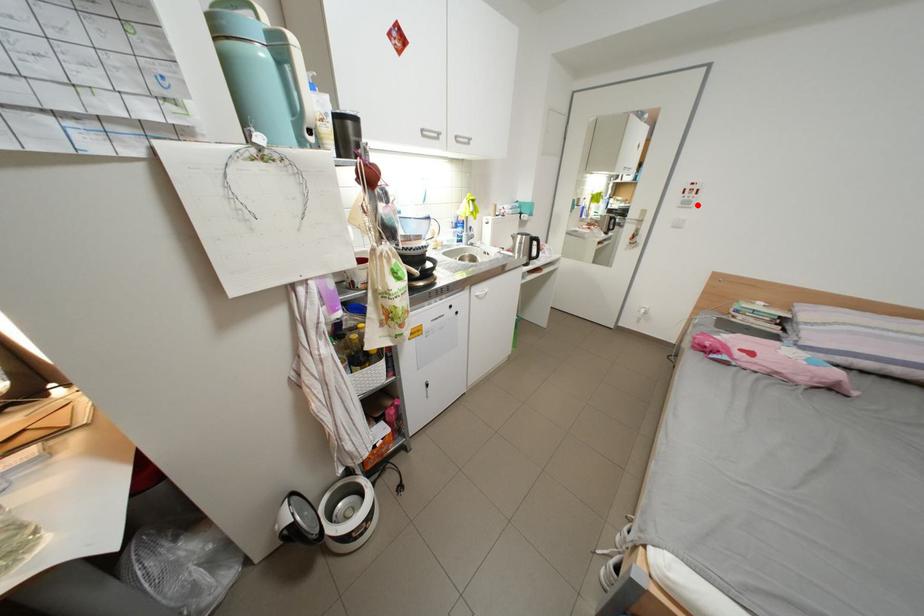
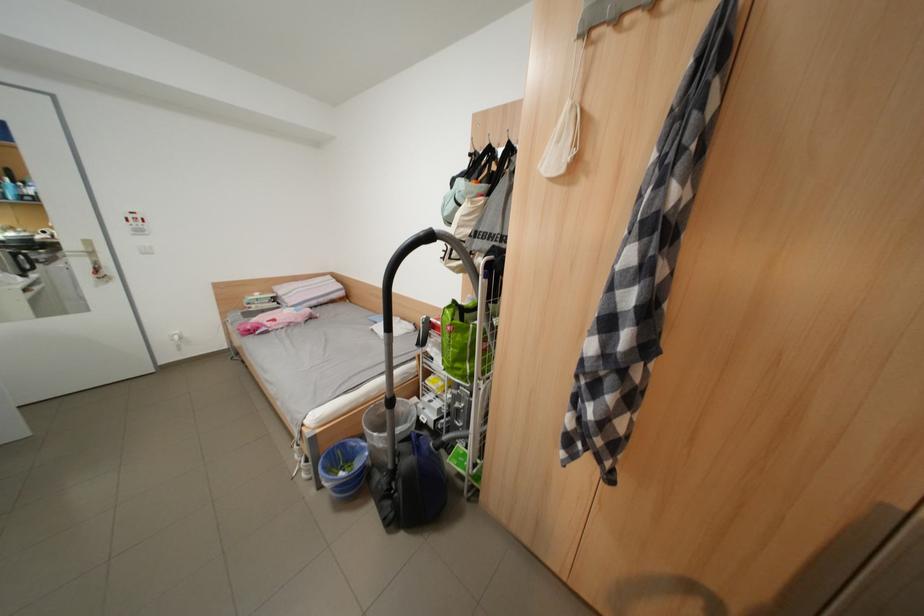
Locate, in the second image, the point that corresponds to the highlighted location in the first image.

(152, 233)